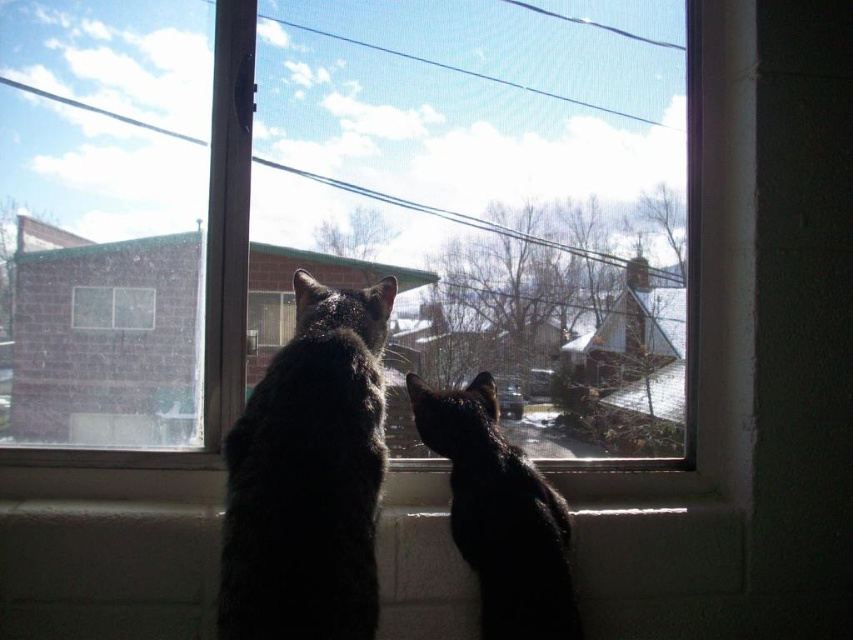
Question: Is transparent glass window at center positioned in front of dark fur cat at center?

Choices:
 (A) yes
 (B) no

Answer: (B)

Question: Can you confirm if transparent glass window at center is positioned below dark fur cat at center?

Choices:
 (A) yes
 (B) no

Answer: (B)

Question: Which point is farther to the camera?

Choices:
 (A) transparent glass window at center
 (B) black glossy cat at center
 (C) dark fur cat at center

Answer: (A)

Question: Estimate the real-world distances between objects in this image. Which object is closer to the black glossy cat at center?

Choices:
 (A) dark fur cat at center
 (B) transparent glass window at center

Answer: (A)

Question: Considering the real-world distances, which object is closest to the transparent glass window at center?

Choices:
 (A) dark fur cat at center
 (B) black glossy cat at center

Answer: (A)

Question: Is dark fur cat at center positioned at the back of black glossy cat at center?

Choices:
 (A) yes
 (B) no

Answer: (B)